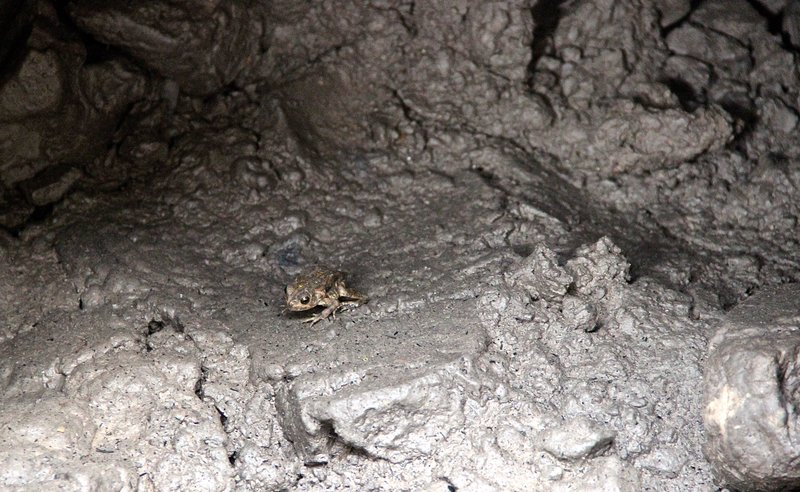
This screenshot has height=492, width=800. What are the coordinates of `light` in the screenshot? It's located at (378, 423).